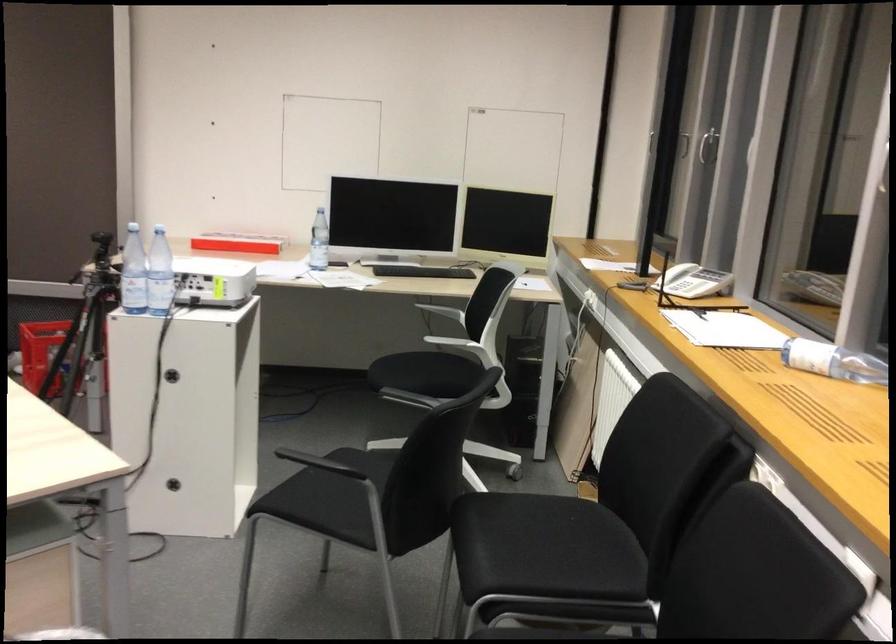
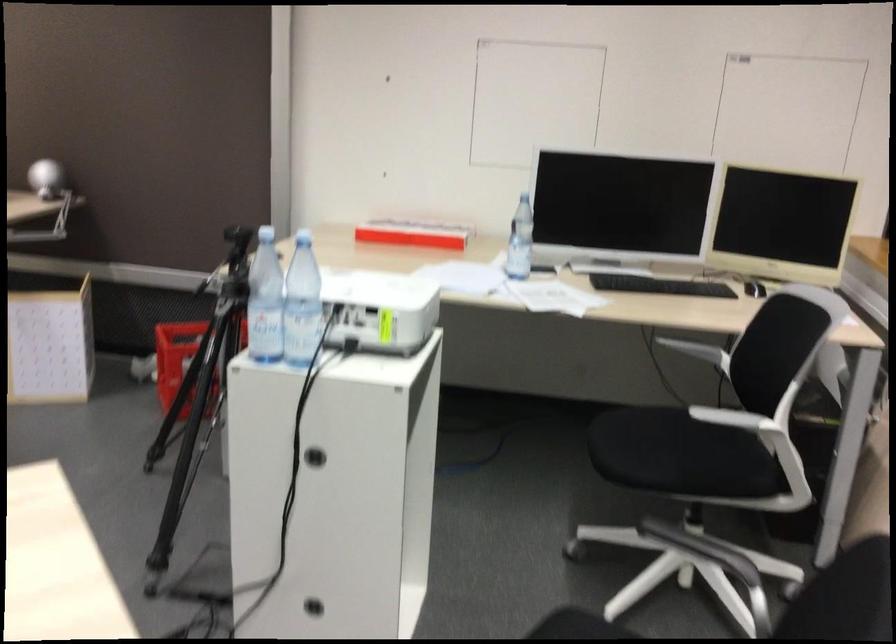
Where in the second image is the point corresponding to point 158,276 from the first image?

(302, 303)